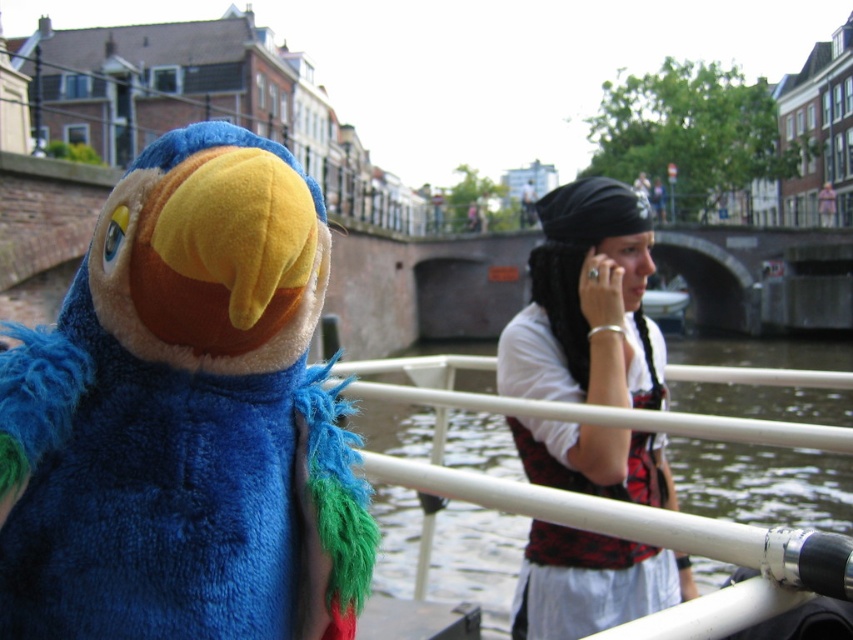
You are a photographer trying to capture the blue plush parrot at left and the green fuzzy water at lower center in a single shot. Which object will appear closer to the camera in your photo?

The blue plush parrot at left will appear closer to the camera because it is positioned in front of the green fuzzy water at lower center.